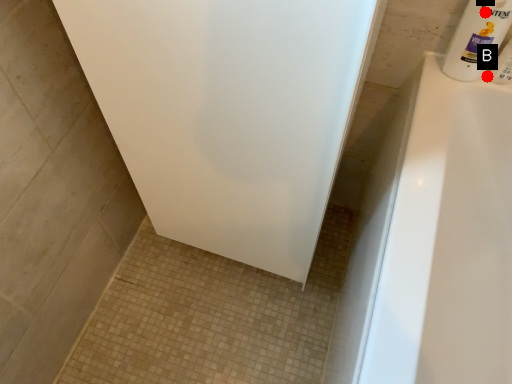
Question: Two points are circled on the image, labeled by A and B beside each circle. Which point is farther from the camera taking this photo?

Choices:
 (A) A is further
 (B) B is further

Answer: (B)